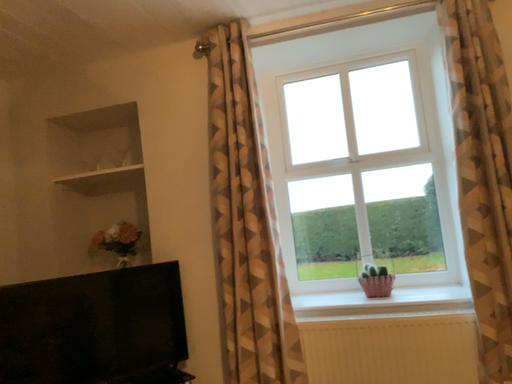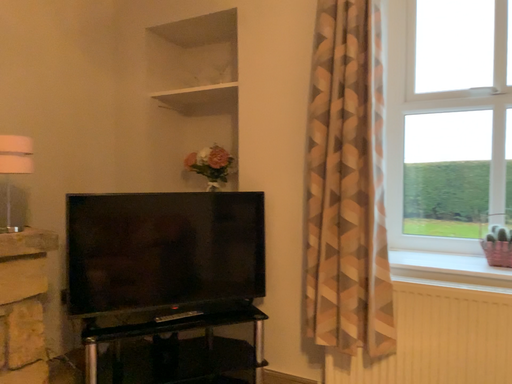
Question: Which way did the camera rotate in the video?

Choices:
 (A) rotated downward
 (B) rotated upward

Answer: (A)